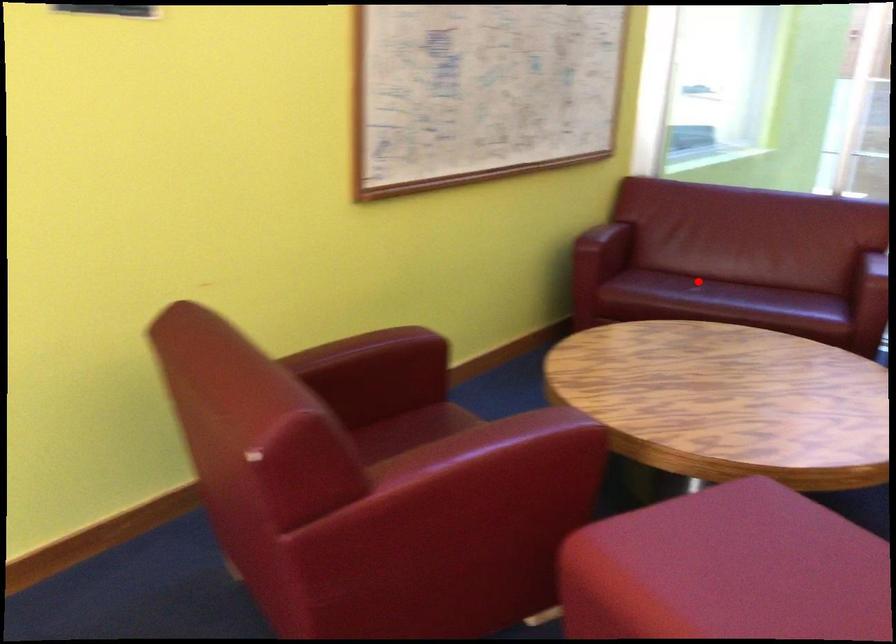
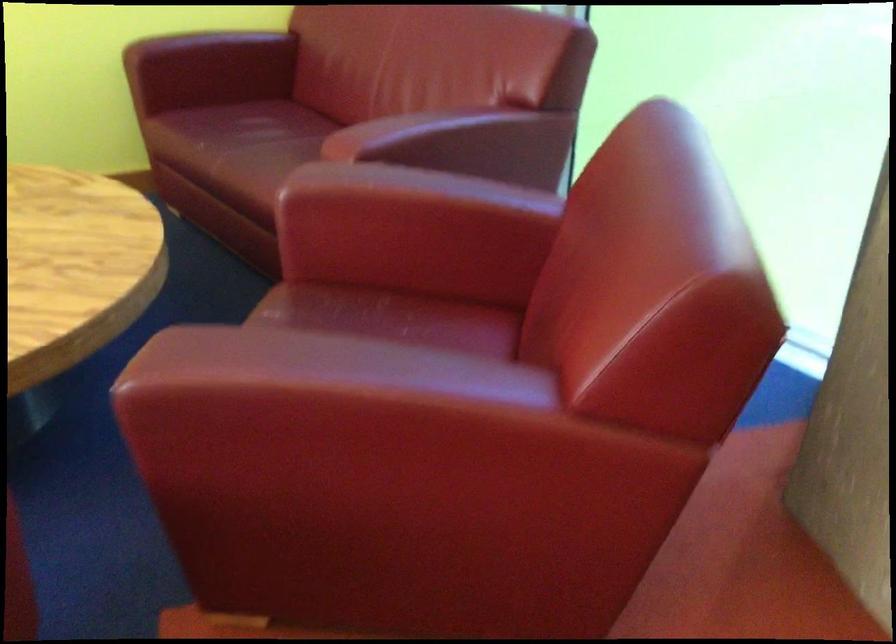
Question: A red point is marked in image1. In image2, is the corresponding 3D point closer to the camera or farther? Reply with the corresponding letter.

Choices:
 (A) The corresponding 3D point is closer.
 (B) The corresponding 3D point is farther.

Answer: (A)